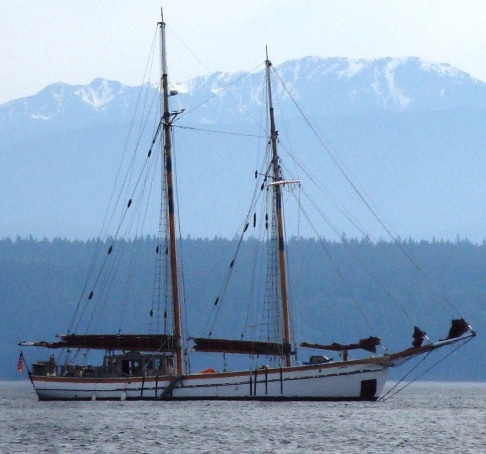
Find the location of a particular element. shade is located at coordinates (214, 347).